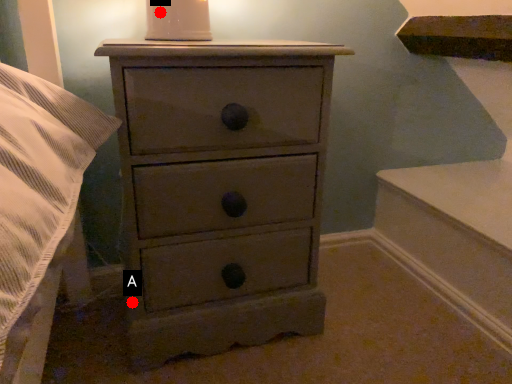
Question: Two points are circled on the image, labeled by A and B beside each circle. Which point is closer to the camera?

Choices:
 (A) A is closer
 (B) B is closer

Answer: (B)